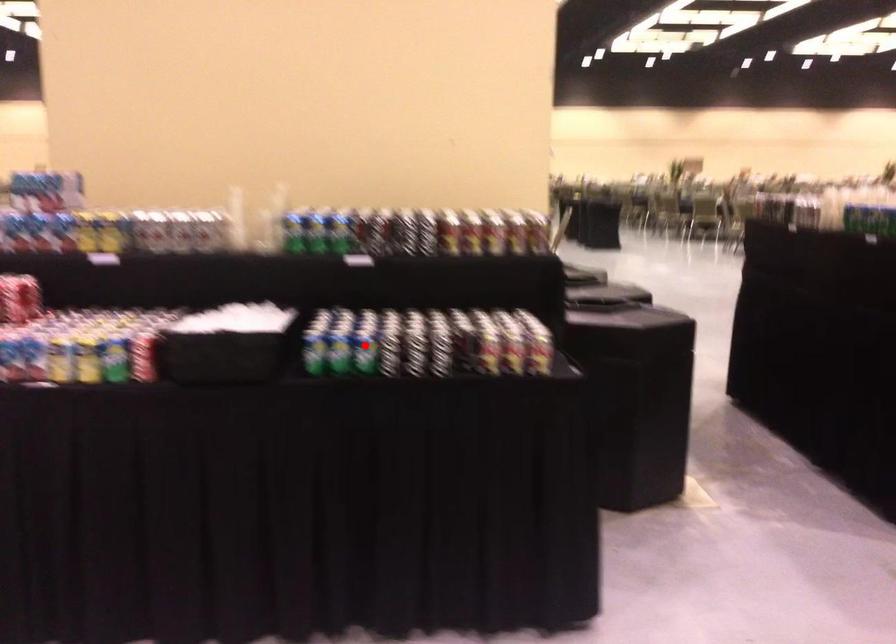
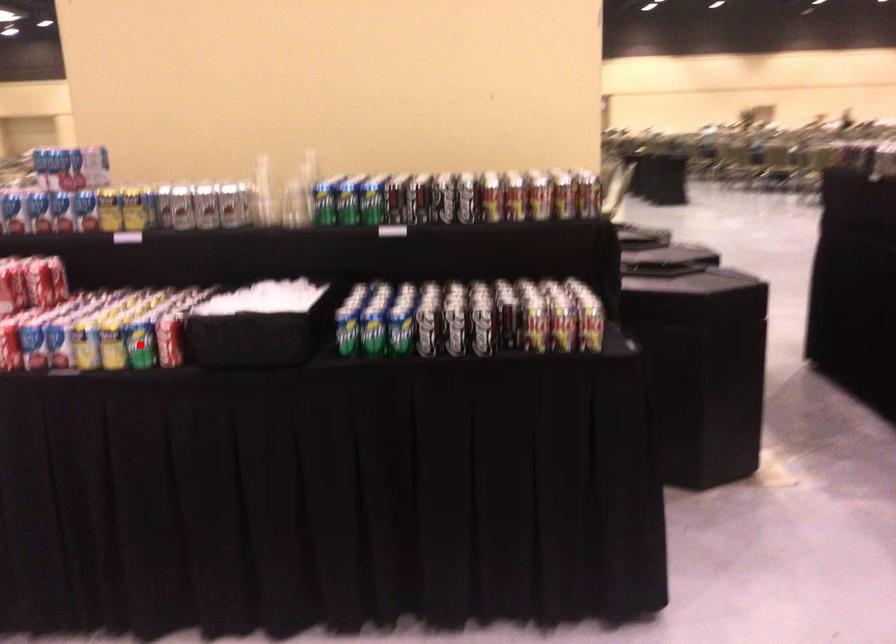
I am providing you with two images of the same scene from different viewpoints. A red point is marked on the first image and another point is marked on the second image. Do the highlighted points in image1 and image2 indicate the same real-world spot?

No